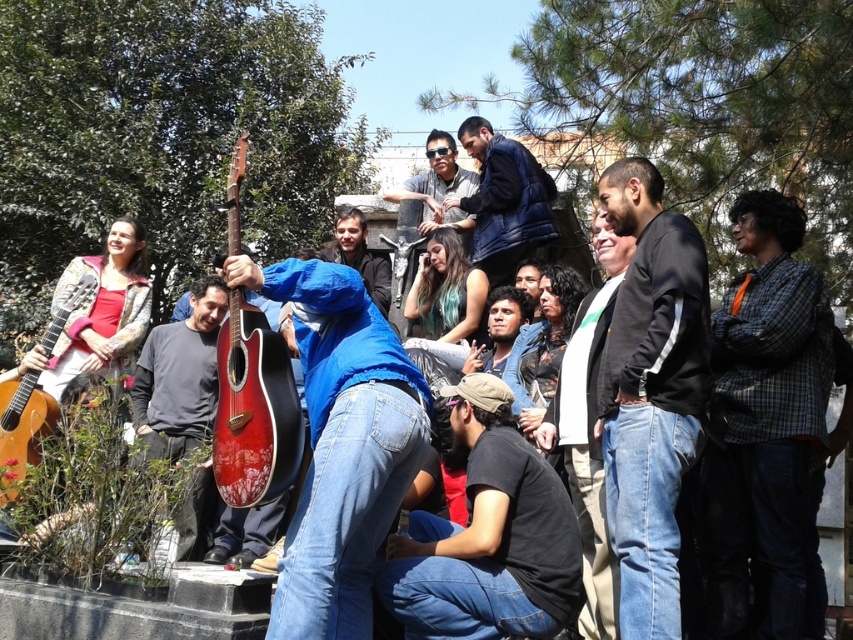
You are a photographer at the event and want to capture a photo of the black matte shirt at lower center and the matte red guitar at center. Since you can only focus on one subject, which one should you choose to ensure the other is still visible in the frame?

The black matte shirt at lower center is to the right of the matte red guitar at center, so focusing on the matte red guitar at center would keep the black matte shirt at lower center visible to its right.

You are a photographer at the event and want to capture a photo that includes both the black matte shirt at lower center and the matte red guitar at center. Which object should you focus on first to ensure both are in the frame?

You should focus on the matte red guitar at center first because the black matte shirt at lower center is in front of it, ensuring both will be in the frame when starting with the guitar.

You are a photographer standing at the camera position. You want to capture a closeup shot of the matte blue hoodie at center. Given that your camera can focus on subjects within 30 meters, will you be able to capture a clear closeup?

The matte blue hoodie at center is 32.44 meters away from the camera, which is beyond the camera focus range of 30 meters. Therefore, the photographer cannot capture a clear closeup.